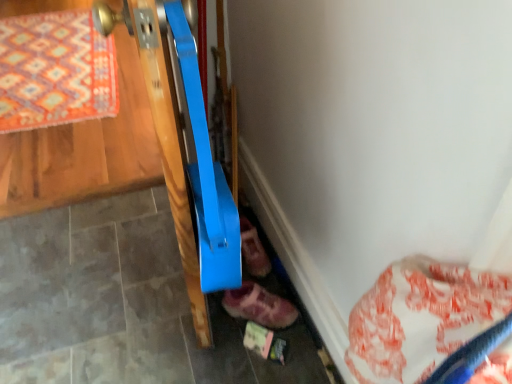
Question: Which direction should I rotate to look at leather suede shoe at lower center, arranged as the first footwear when viewed from the front?

Choices:
 (A) right
 (B) left

Answer: (A)

Question: Is leather pink shoe at lower center, acting as the 2th footwear starting from the front, positioned with its back to orange patterned rug at upper left?

Choices:
 (A) no
 (B) yes

Answer: (B)

Question: Is leather pink shoe at lower center, which is the first footwear in back-to-front order, bigger than orange patterned rug at upper left?

Choices:
 (A) no
 (B) yes

Answer: (A)

Question: Can you confirm if leather pink shoe at lower center, which is the first footwear in back-to-front order, is positioned to the left of orange patterned rug at upper left?

Choices:
 (A) yes
 (B) no

Answer: (B)

Question: Considering the relative sizes of leather pink shoe at lower center, which is the first footwear in back-to-front order, and orange patterned rug at upper left in the image provided, is leather pink shoe at lower center, which is the first footwear in back-to-front order, thinner than orange patterned rug at upper left?

Choices:
 (A) yes
 (B) no

Answer: (A)

Question: Is orange patterned rug at upper left surrounded by leather pink shoe at lower center, acting as the 2th footwear starting from the front?

Choices:
 (A) no
 (B) yes

Answer: (A)

Question: From the image's perspective, does leather pink shoe at lower center, acting as the 2th footwear starting from the front, appear lower than orange patterned rug at upper left?

Choices:
 (A) no
 (B) yes

Answer: (B)

Question: Can you confirm if leather suede shoe at lower center, acting as the 2th footwear starting from the back, is shorter than leather pink shoe at lower center, which is the first footwear in back-to-front order?

Choices:
 (A) yes
 (B) no

Answer: (B)

Question: Does leather suede shoe at lower center, acting as the 2th footwear starting from the back, have a greater width compared to leather pink shoe at lower center, acting as the 2th footwear starting from the front?

Choices:
 (A) no
 (B) yes

Answer: (B)

Question: Considering the relative sizes of leather suede shoe at lower center, acting as the 2th footwear starting from the back, and leather pink shoe at lower center, which is the first footwear in back-to-front order, in the image provided, is leather suede shoe at lower center, acting as the 2th footwear starting from the back, thinner than leather pink shoe at lower center, which is the first footwear in back-to-front order,?

Choices:
 (A) no
 (B) yes

Answer: (A)

Question: From a real-world perspective, is leather suede shoe at lower center, arranged as the first footwear when viewed from the front, positioned under leather pink shoe at lower center, acting as the 2th footwear starting from the front, based on gravity?

Choices:
 (A) no
 (B) yes

Answer: (B)

Question: Is leather suede shoe at lower center, acting as the 2th footwear starting from the back, behind leather pink shoe at lower center, which is the first footwear in back-to-front order?

Choices:
 (A) yes
 (B) no

Answer: (B)

Question: Is leather suede shoe at lower center, arranged as the first footwear when viewed from the front, oriented away from leather pink shoe at lower center, which is the first footwear in back-to-front order?

Choices:
 (A) no
 (B) yes

Answer: (A)

Question: Is leather pink shoe at lower center, acting as the 2th footwear starting from the front, looking in the opposite direction of leather suede shoe at lower center, acting as the 2th footwear starting from the back?

Choices:
 (A) yes
 (B) no

Answer: (B)